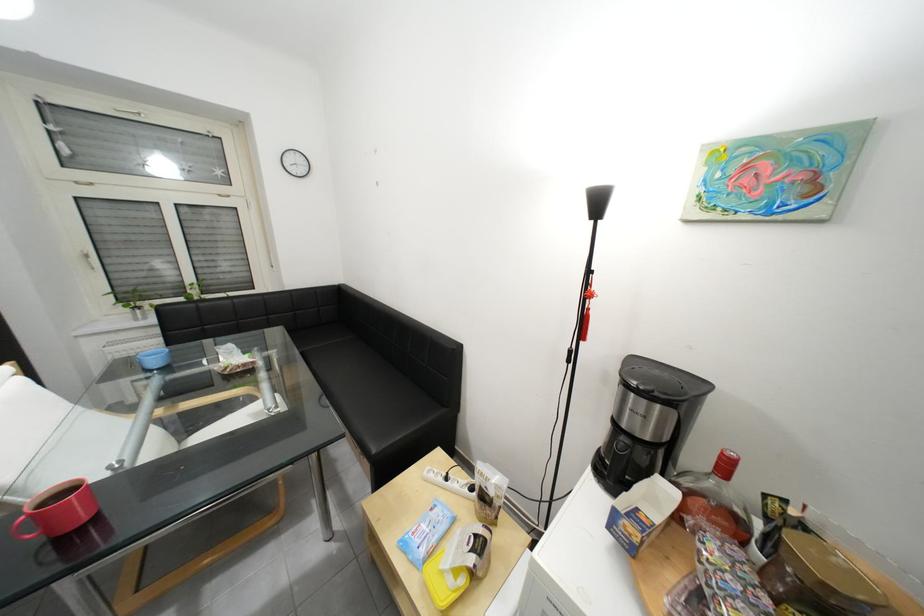
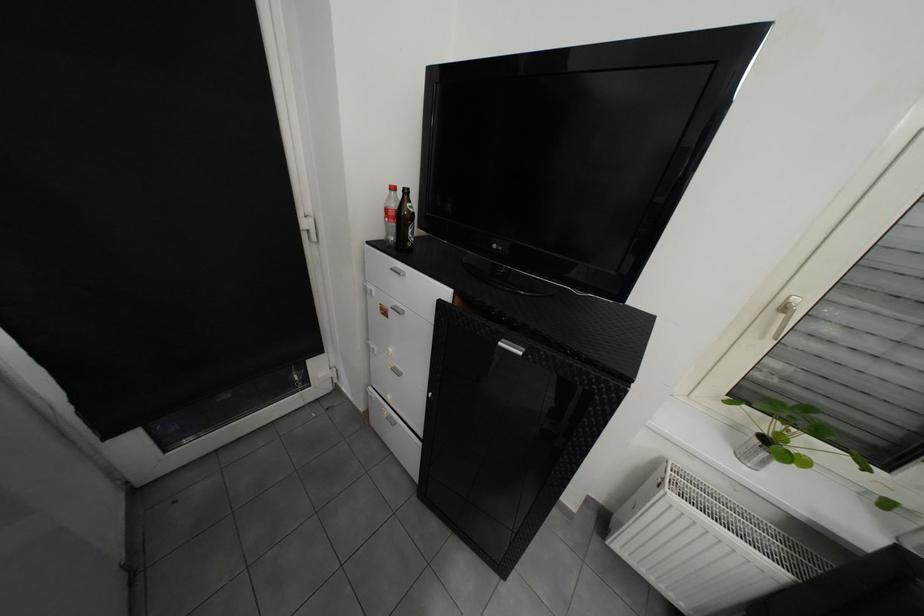
Find the pixel in the second image that matches point (148, 321) in the first image.

(754, 458)